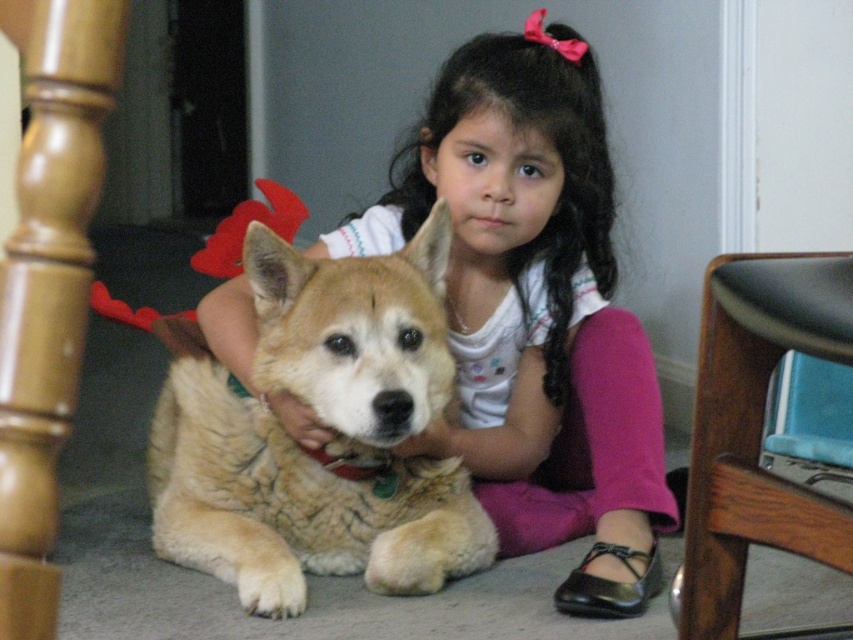
Question: Which point is farther to the camera?

Choices:
 (A) (461, 324)
 (B) (256, 360)
 (C) (814, 276)

Answer: (A)

Question: Which point appears farthest from the camera in this image?

Choices:
 (A) (749, 516)
 (B) (357, 422)
 (C) (672, 515)

Answer: (C)

Question: Can you confirm if golden fur dog at center is thinner than wooden chair at lower right?

Choices:
 (A) no
 (B) yes

Answer: (A)

Question: Which object is the closest to the golden fur dog at center?

Choices:
 (A) smooth white shirt at center
 (B) wooden chair at lower right

Answer: (A)

Question: Where is golden fur dog at center located in relation to wooden chair at lower right in the image?

Choices:
 (A) below
 (B) above

Answer: (A)

Question: Can you confirm if smooth white shirt at center is bigger than wooden chair at lower right?

Choices:
 (A) no
 (B) yes

Answer: (B)